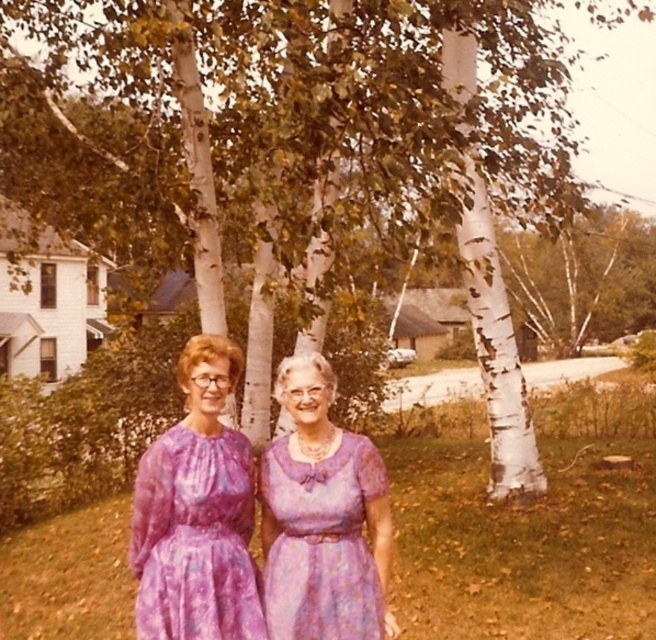
Question: Which point is closer to the camera?

Choices:
 (A) purple floral dress at center
 (B) purple tie-dye dress at center

Answer: (A)

Question: Does purple floral dress at center appear under purple tie-dye dress at center?

Choices:
 (A) yes
 (B) no

Answer: (B)

Question: Can you confirm if purple floral dress at center is smaller than purple tie-dye dress at center?

Choices:
 (A) yes
 (B) no

Answer: (B)

Question: Which point appears farthest from the camera in this image?

Choices:
 (A) (342, 593)
 (B) (146, 632)

Answer: (A)

Question: Is purple floral dress at center below purple tie-dye dress at center?

Choices:
 (A) no
 (B) yes

Answer: (A)